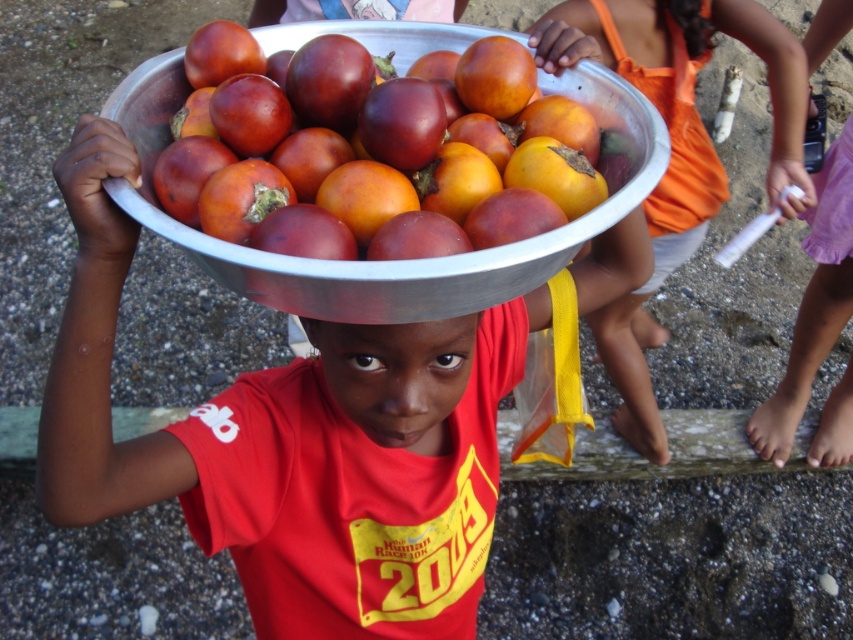
Identify the location of shiny metallic bowl at center. Image resolution: width=853 pixels, height=640 pixels. (364, 154).

Can you confirm if shiny metallic bowl at center is positioned to the right of matte orange bowl at center?

In fact, shiny metallic bowl at center is to the left of matte orange bowl at center.

Is point (231, 113) closer to camera compared to point (706, 0)?

Yes, it is in front of point (706, 0).

At what (x,y) coordinates should I click in order to perform the action: click on shiny metallic bowl at center. Please return your answer as a coordinate pair (x, y). Looking at the image, I should click on (364, 154).

Does point (125, 148) come behind point (337, 54)?

No, it is in front of (337, 54).

Is matte metallic bowl at center below shiny metallic bowl at center?

Yes, matte metallic bowl at center is below shiny metallic bowl at center.

Measure the distance between point (x=276, y=628) and camera.

Point (x=276, y=628) and camera are 3.60 feet apart.

Where is `matte metallic bowl at center`? The width and height of the screenshot is (853, 640). matte metallic bowl at center is located at coordinates (273, 422).

Based on the photo, who is more forward, (498, 328) or (596, 58)?

Positioned in front is point (596, 58).

Measure the distance from matte metallic bowl at center to matte orange bowl at center.

matte metallic bowl at center and matte orange bowl at center are 30.88 inches apart from each other.

Between point (239, 476) and point (697, 173), which one is positioned behind?

Positioned behind is point (697, 173).

Find the location of `matte metallic bowl at center`. matte metallic bowl at center is located at coordinates (273, 422).